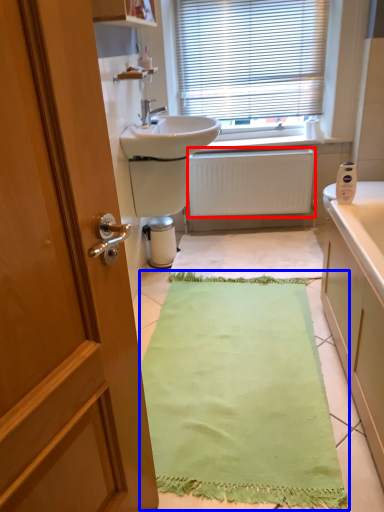
Question: Which point is further to the camera, radiator (highlighted by a red box) or bath mat (highlighted by a blue box)?

Choices:
 (A) radiator
 (B) bath mat

Answer: (A)